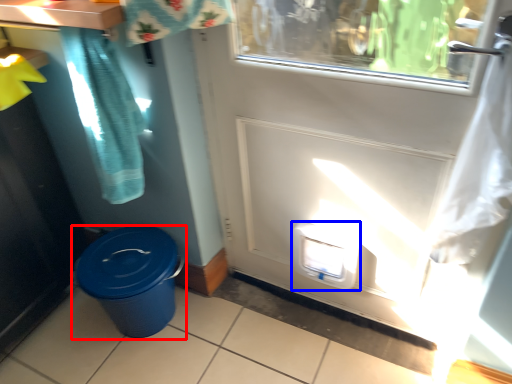
Question: Which of the following is the closest to the observer, waste container (highlighted by a red box) or water cooler (highlighted by a blue box)?

Choices:
 (A) waste container
 (B) water cooler

Answer: (B)